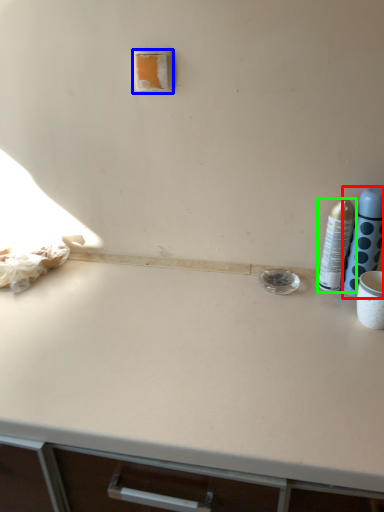
Question: Based on their relative distances, which object is nearer to bottle (highlighted by a red box)? Choose from light switch (highlighted by a blue box) and bottle (highlighted by a green box).

Choices:
 (A) light switch
 (B) bottle

Answer: (B)